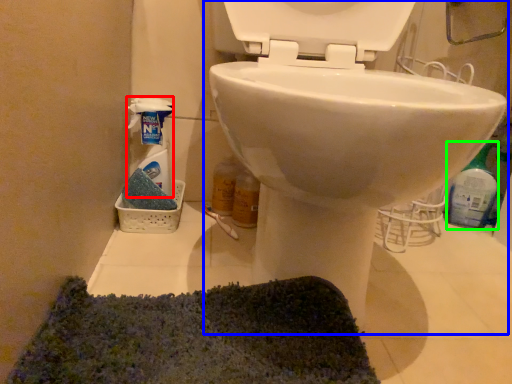
Question: Considering the real-world distances, which object is closest to cleaning product (highlighted by a red box)? toilet (highlighted by a blue box) or cleaning product (highlighted by a green box).

Choices:
 (A) toilet
 (B) cleaning product

Answer: (A)